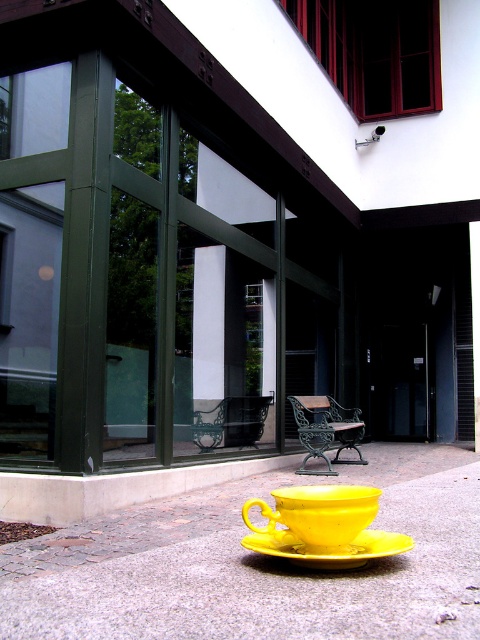
You are standing at the point marked as point (216, 488) in the image. You want to walk to the building with red accents in the upper section. How far will you have to walk to reach the building?

The distance between point (216, 488) and the viewer is 6.60 meters. Since the building with red accents is in the background, it is farther away than the point. Therefore, you would need to walk more than 6.60 meters to reach the building.

You are a delivery robot with a 2.5 meters long package. You need to place the package between the yellow ceramic cup at lower center and the yellow matte teacup at lower center. Can you fit the package between them?

The distance between the yellow ceramic cup at lower center and the yellow matte teacup at lower center is 2.31 meters. Since the package is 2.5 meters long, it cannot fit between them as the space is shorter than the package.

You are standing in the courtyard and want to place a new decorative item exactly where the yellow ceramic cup at center is currently located. The cup is marked by point (252, 568) in the image. What are the coordinates of the location where you should place the new item?

The coordinates for the location where the yellow ceramic cup at center is placed are point (252, 568).